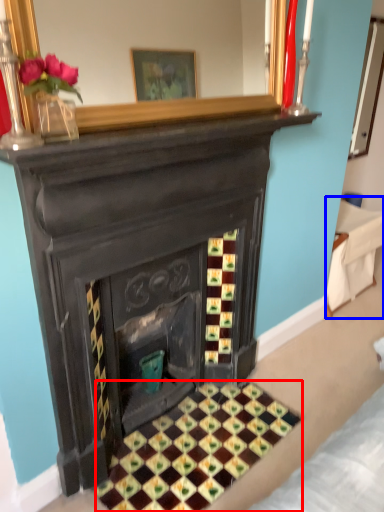
Question: Which object appears closest to the camera in this image, pattern (highlighted by a red box) or furniture (highlighted by a blue box)?

Choices:
 (A) pattern
 (B) furniture

Answer: (A)